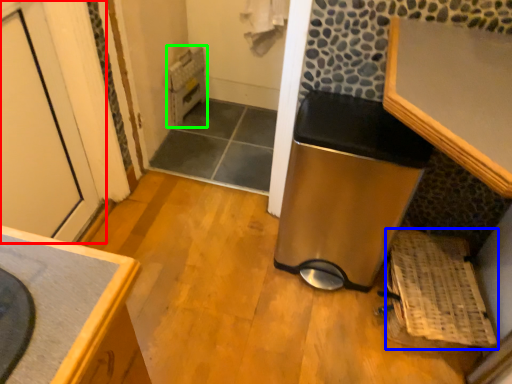
Question: Considering the real-world distances, which object is farthest from door (highlighted by a red box)? basket (highlighted by a blue box) or water heater (highlighted by a green box)?

Choices:
 (A) basket
 (B) water heater

Answer: (A)